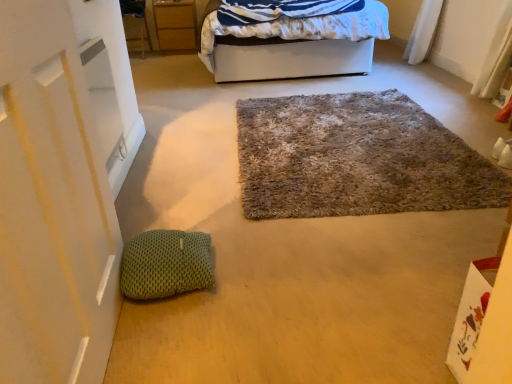
Question: In the image, is green knitted pillow at lower left positioned in front of or behind white fabric bed at upper center?

Choices:
 (A) behind
 (B) front

Answer: (B)

Question: Considering the positions of point (192, 248) and point (268, 61), is point (192, 248) closer or farther from the camera than point (268, 61)?

Choices:
 (A) closer
 (B) farther

Answer: (A)

Question: Which of these objects is positioned closest to the fuzzy carpet at center?

Choices:
 (A) white fabric bed at upper center
 (B) green knitted pillow at lower left
 (C) matte wood cabinet at upper left

Answer: (B)

Question: Estimate the real-world distances between objects in this image. Which object is closer to the white fabric bed at upper center?

Choices:
 (A) matte wood cabinet at upper left
 (B) green knitted pillow at lower left
 (C) fuzzy carpet at center

Answer: (C)